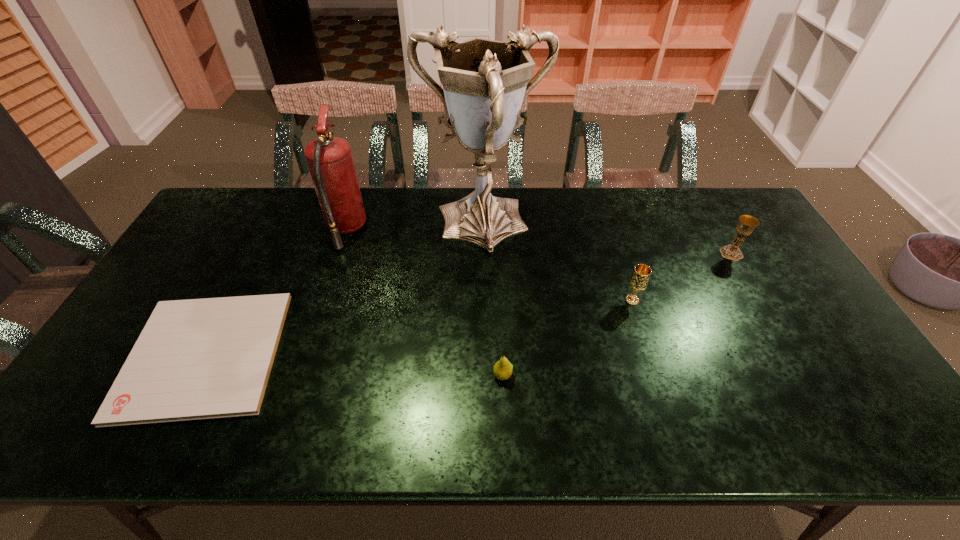
Where is `trophy cup`? trophy cup is located at coordinates (484, 81).

This screenshot has width=960, height=540. What are the coordinates of `the fifth shortest object` in the screenshot? It's located at (329, 159).

This screenshot has height=540, width=960. Identify the location of the rightmost object. (747, 224).

Where is `the farther chalice`? the farther chalice is located at coordinates (747, 224).

Find the location of a particular element. This screenshot has height=540, width=960. the nearer chalice is located at coordinates (638, 282).

This screenshot has width=960, height=540. Identify the location of the second object from right to left. (638, 282).

Identify the location of pear. (502, 370).

The width and height of the screenshot is (960, 540). Identify the location of clipboard. (207, 358).

Image resolution: width=960 pixels, height=540 pixels. I want to click on vacant region located on the right of the tallest object, so (576, 226).

Where is `vacant position located at the front of the fifth shortest object where the nozzle is aimed`? vacant position located at the front of the fifth shortest object where the nozzle is aimed is located at coordinates coord(384,230).